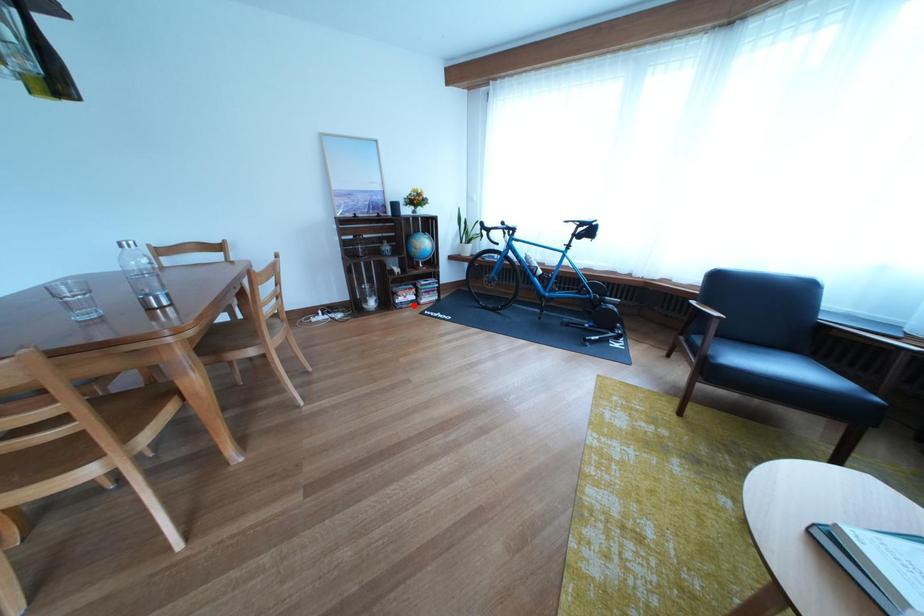
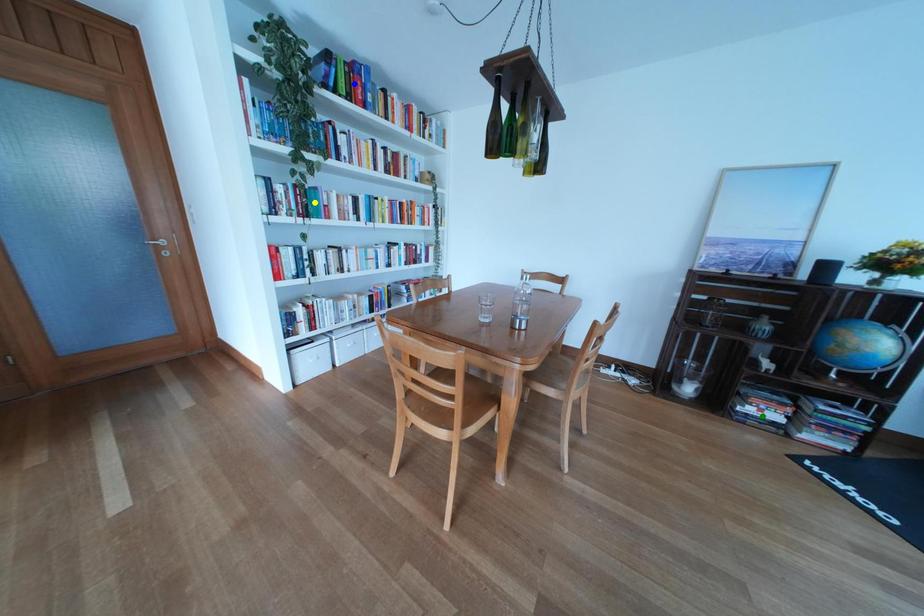
Question: I am providing you with two images of the same scene from different viewpoints. A red point is marked on the first image. You are given multiple points on the second image. Which spot in image 2 lines up with the point in image 1?

Choices:
 (A) yellow point
 (B) green point
 (C) blue point

Answer: (B)